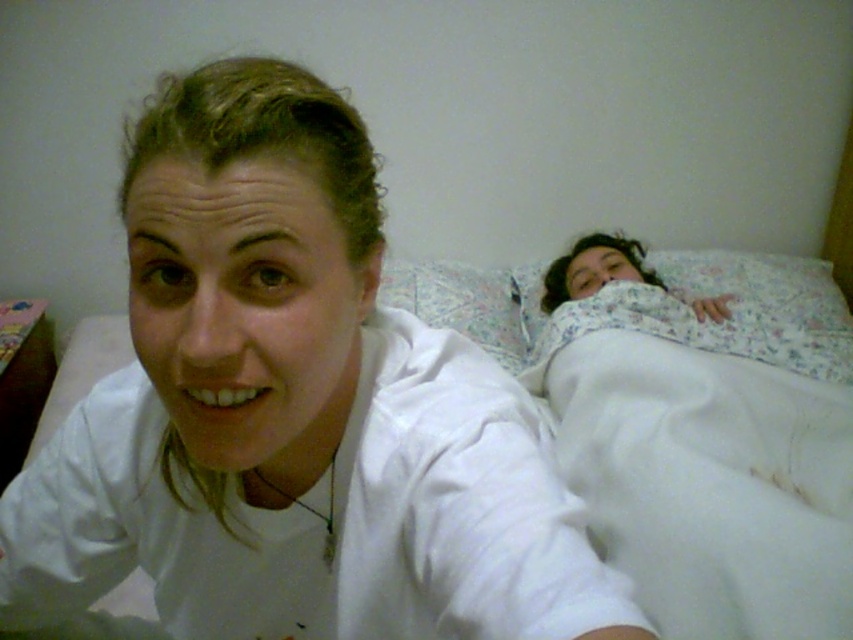
You are a fashion designer analyzing the image. You need to determine which item is taller between the white matte shirt at center and the white soft fabric at upper right. Based on the scene, which one is taller?

The white matte shirt at center is much taller than the white soft fabric at upper right.

You are a photographer trying to focus on the white matte shirt at center. Will the white soft fabric at upper right be visible in the background of your photo?

The white matte shirt at center is in front of the white soft fabric at upper right, so the fabric might be visible in the background but could be less distinct due to similar colors.